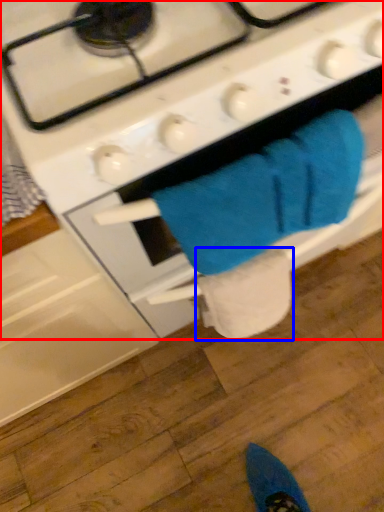
Question: Which point is further to the camera, gas stove (highlighted by a red box) or toilet paper (highlighted by a blue box)?

Choices:
 (A) gas stove
 (B) toilet paper

Answer: (B)